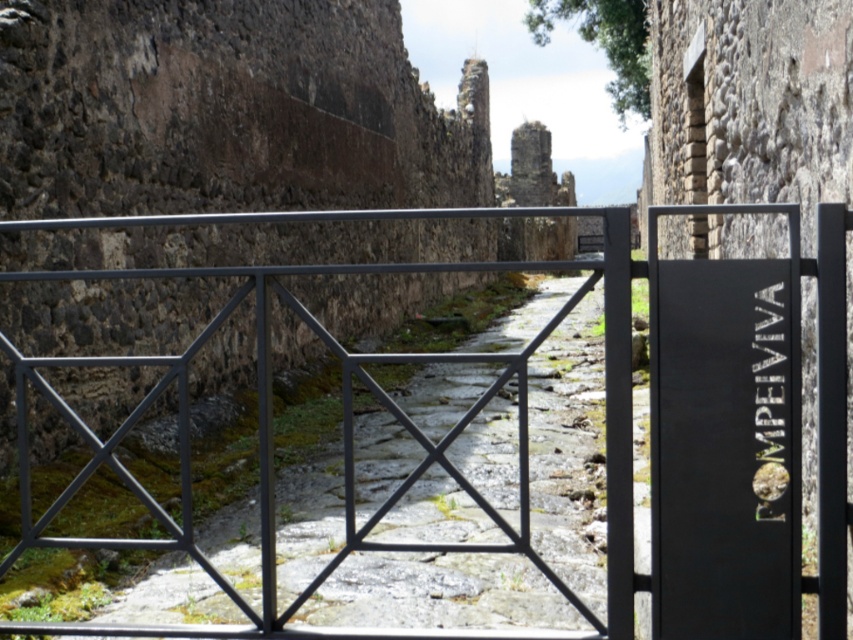
You are a tourist standing at the entrance of the ancient ruins. You see a black metal gate at center and a black matte sign at right. Which object is positioned higher in the image?

The black metal gate at center is above the black matte sign at right, so the black metal gate at center is positioned higher in the image.

You are a tour guide leading a group through ancient ruins. You need to ensure that all visitors can pass through the black metal gate at center and the black matte sign at right. Which object requires more space to accommodate visitors?

The black metal gate at center requires more space because its width is larger than the black matte sign at right.